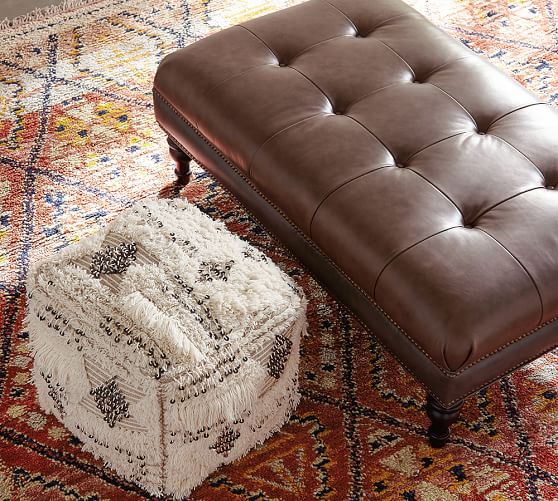
Where is `corner`? This screenshot has height=501, width=558. corner is located at coordinates [461, 348], [165, 66], [163, 364], [44, 268], [168, 204], [294, 305], [293, 407], [158, 487], [37, 393].